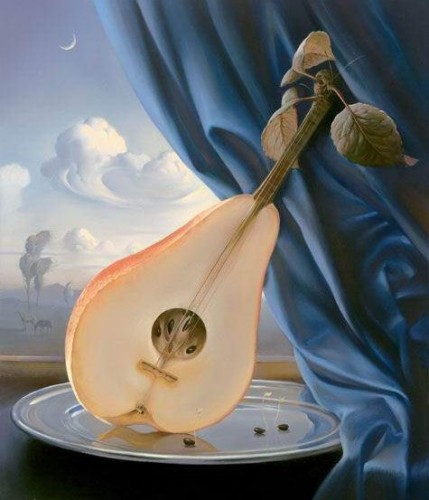
The width and height of the screenshot is (429, 500). In order to click on black table underneath plate in this screenshot , I will do `click(23, 455)`, `click(86, 487)`, `click(218, 485)`, `click(310, 468)`.